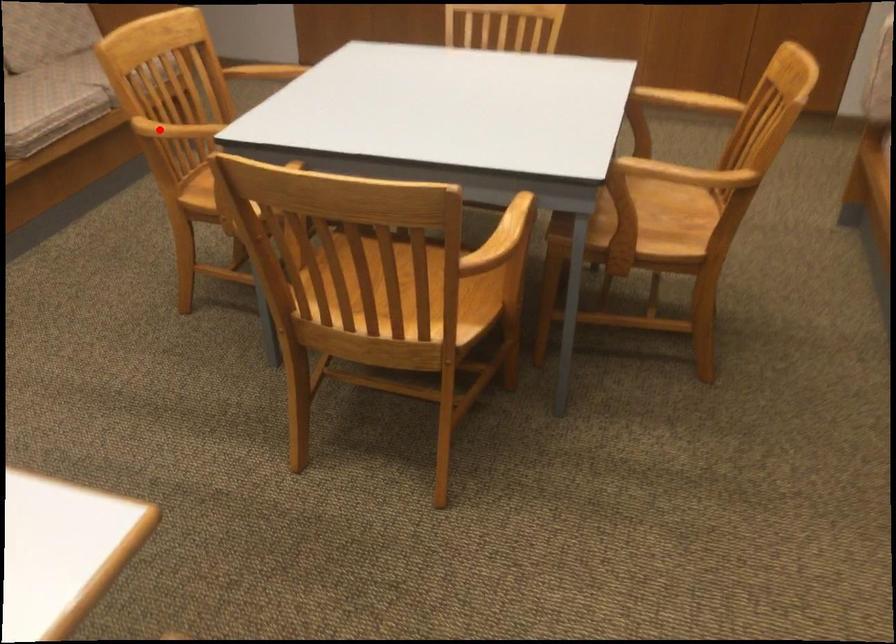
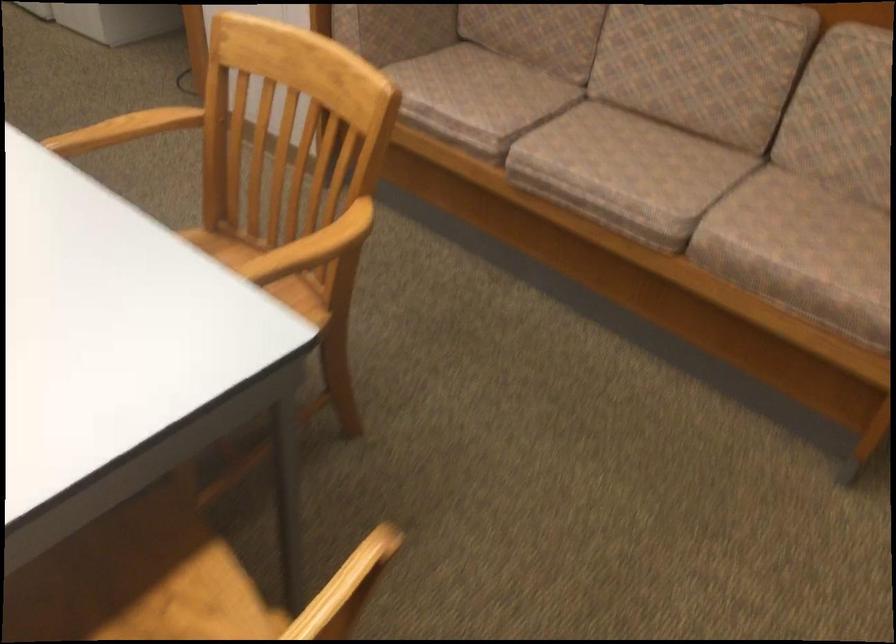
Where in the second image is the point corresponding to the highlighted location from the first image?

(151, 122)